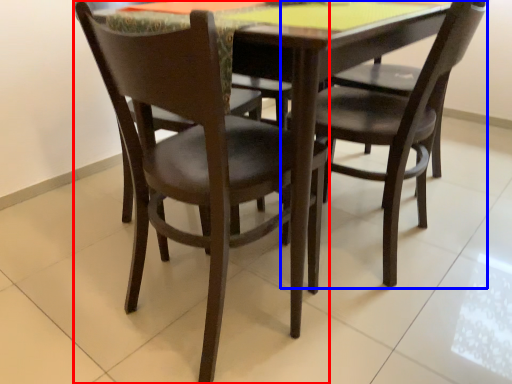
Question: Among these objects, which one is nearest to the camera, chair (highlighted by a red box) or chair (highlighted by a blue box)?

Choices:
 (A) chair
 (B) chair

Answer: (A)